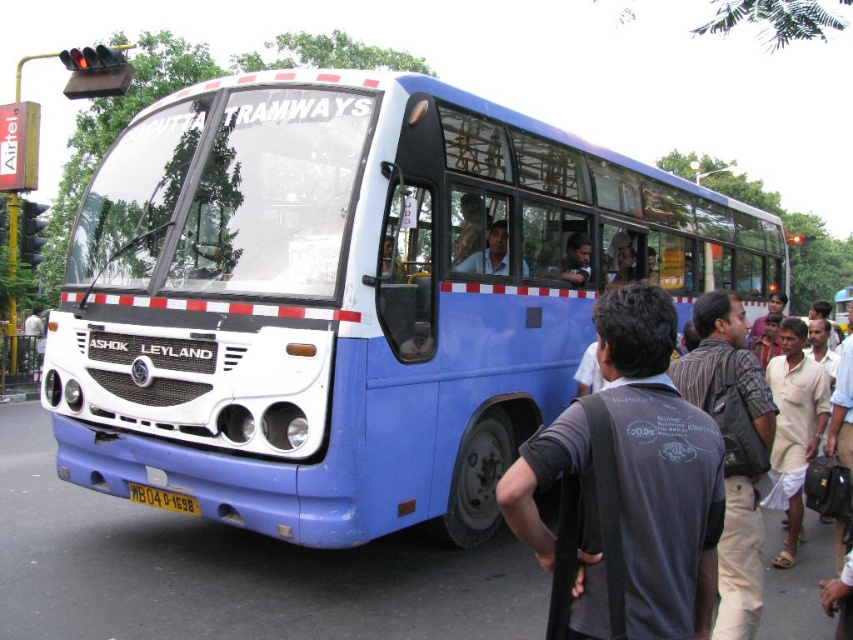
You are a pedestrian standing at the point with coordinates (352, 298). You want to cross the road safely. Based on the scene, what object is directly in front of you at that point?

The point at coordinates (352, 298) corresponds to the blue matte bus at center, so the bus is directly in front of you at that point.

You are a passenger on the blue and white bus labeled KOLKATA TRAMWAYS. You notice two points marked on the windshield. The first point is at coordinates point [100,486] and the second is at point [657,557]. Which point is closer to the front of the bus?

Point [657,557] is closer to the front of the bus because it is in front of point [100,486], which is behind it.

You are standing at the traffic light and want to know how far you are from the point marked as point (x=502, y=237) on the bus. Can you determine the distance?

The distance of point (x=502, y=237) from the viewer is 5.68 meters, so you are 5.68 meters away from the point marked as point (x=502, y=237) on the bus.